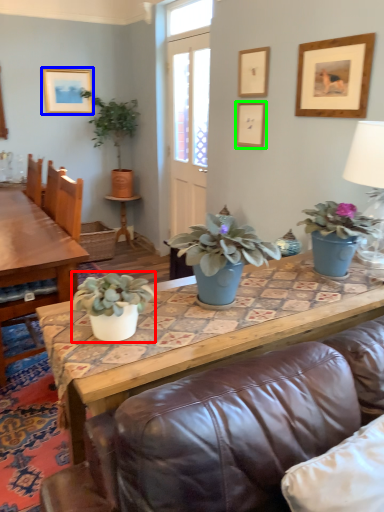
Question: Considering the real-world distances, which object is farthest from houseplant (highlighted by a red box)? picture frame (highlighted by a blue box) or picture frame (highlighted by a green box)?

Choices:
 (A) picture frame
 (B) picture frame

Answer: (A)